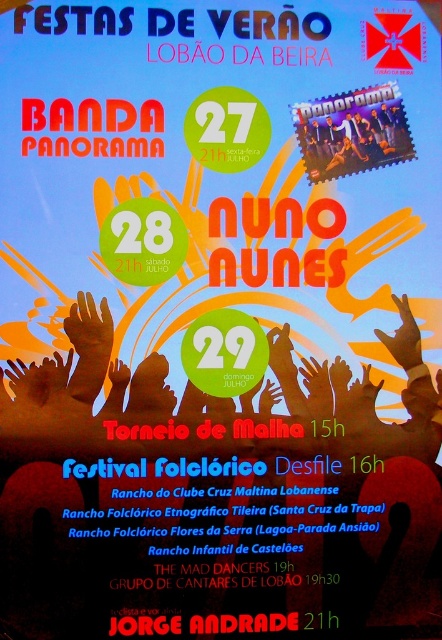
You are designing a poster and need to place a new element between the brown matte hands at center and the matte black band at upper right. Based on their current positions, which object should the new element be closer to?

The new element should be closer to the brown matte hands at center because it is in front of the matte black band at upper right, meaning it is closer to the viewer.

You are designing a promotional poster and need to ensure that the brown matte hands at center and the matte black band at upper right are proportionally sized. According to the design specifications, which object has a greater width?

The brown matte hands at center has a greater width than the matte black band at upper right according to the description.